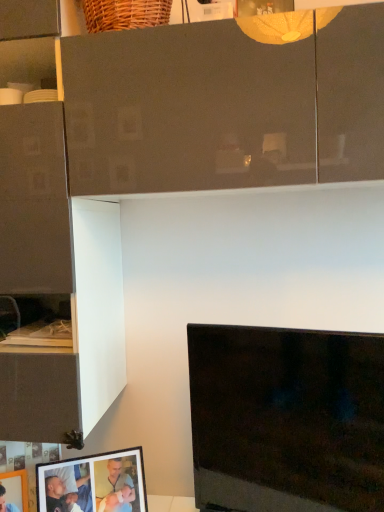
Question: Looking at the image, does matte black picture frame at lower left, placed as the 1th picture frame when sorted from left to right, seem bigger or smaller compared to black glossy tv at lower right?

Choices:
 (A) small
 (B) big

Answer: (A)

Question: From the image's perspective, is matte black picture frame at lower left, placed as the 1th picture frame when sorted from left to right, positioned above or below black glossy tv at lower right?

Choices:
 (A) above
 (B) below

Answer: (B)

Question: Which of these objects is positioned closest to the matte black picture frame at lower left, arranged as the 1th picture frame when viewed from the right?

Choices:
 (A) black glossy tv at lower right
 (B) matte black picture frame at lower left, placed as the 1th picture frame when sorted from left to right

Answer: (B)

Question: Which object is the farthest from the matte black picture frame at lower left, placed as the 1th picture frame when sorted from left to right?

Choices:
 (A) matte black picture frame at lower left, arranged as the 1th picture frame when viewed from the right
 (B) black glossy tv at lower right

Answer: (B)